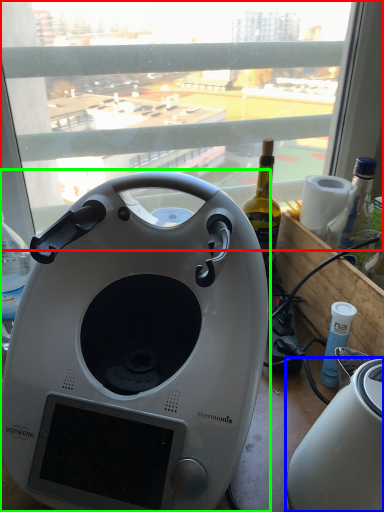
Question: Which object is the farthest from window (highlighted by a red box)? Choose among these: toaster (highlighted by a blue box) or home appliance (highlighted by a green box).

Choices:
 (A) toaster
 (B) home appliance

Answer: (A)